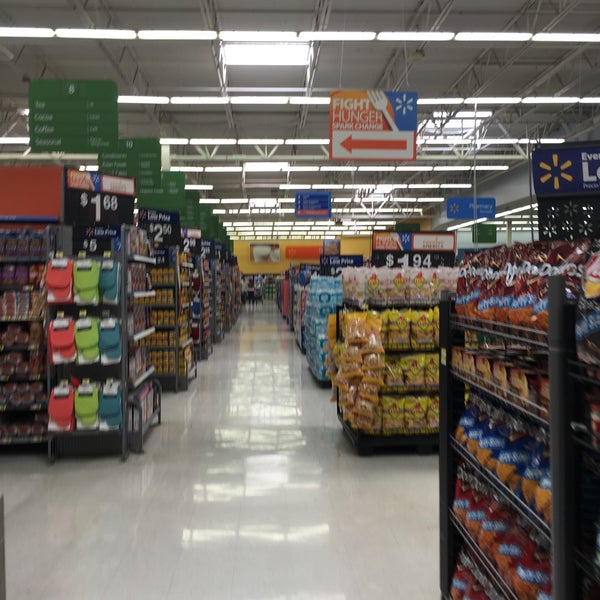
Locate an element on the screen. This screenshot has height=600, width=600. rectangular photograph of inside of walmart store is located at coordinates (7, 8).